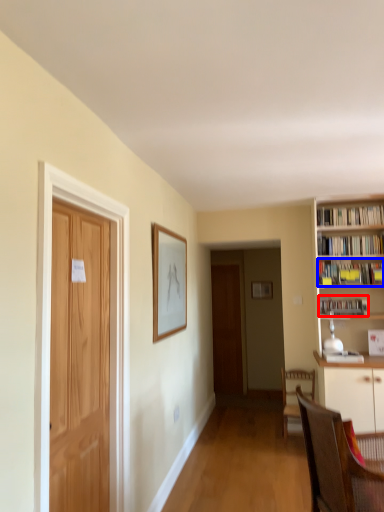
Question: Which of the following is the farthest to the observer, book (highlighted by a red box) or book (highlighted by a blue box)?

Choices:
 (A) book
 (B) book

Answer: (A)